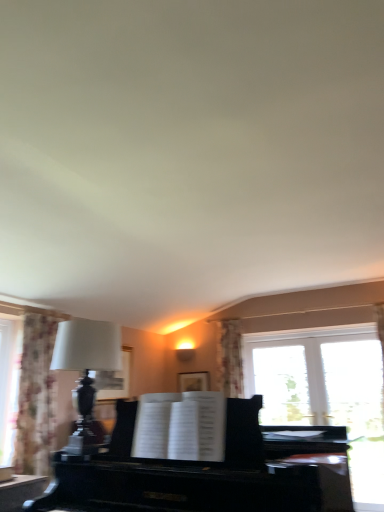
Question: Is black polished piano at center positioned behind matte black lamp at left?

Choices:
 (A) yes
 (B) no

Answer: (B)

Question: Is black polished piano at center at the right side of matte black lamp at left?

Choices:
 (A) no
 (B) yes

Answer: (B)

Question: Is black polished piano at center shorter than matte black lamp at left?

Choices:
 (A) yes
 (B) no

Answer: (B)

Question: Is black polished piano at center far from matte black lamp at left?

Choices:
 (A) no
 (B) yes

Answer: (A)

Question: Is black polished piano at center in front of matte black lamp at left?

Choices:
 (A) no
 (B) yes

Answer: (B)

Question: From a real-world perspective, is black polished piano at center positioned under matte black lamp at left based on gravity?

Choices:
 (A) no
 (B) yes

Answer: (B)

Question: Is matte black lamp at left next to black polished piano at center?

Choices:
 (A) no
 (B) yes

Answer: (A)

Question: Can you confirm if matte black lamp at left is thinner than black polished piano at center?

Choices:
 (A) no
 (B) yes

Answer: (B)

Question: Is matte black lamp at left far away from black polished piano at center?

Choices:
 (A) no
 (B) yes

Answer: (A)

Question: Considering the relative sizes of matte black lamp at left and black polished piano at center in the image provided, is matte black lamp at left smaller than black polished piano at center?

Choices:
 (A) yes
 (B) no

Answer: (A)

Question: Does matte black lamp at left come behind black polished piano at center?

Choices:
 (A) no
 (B) yes

Answer: (B)

Question: From the image's perspective, is matte black lamp at left on black polished piano at center?

Choices:
 (A) no
 (B) yes

Answer: (B)

Question: Is there a large distance between matte black lamp at left and floral fabric curtain at left?

Choices:
 (A) no
 (B) yes

Answer: (B)